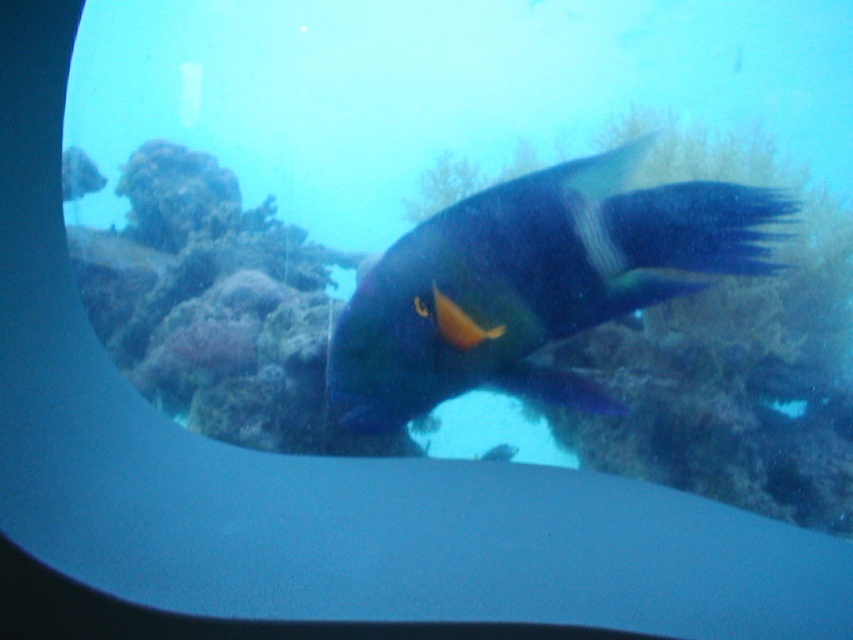
Is purple coral at center to the left of shiny blue fish at center from the viewer's perspective?

Correct, you'll find purple coral at center to the left of shiny blue fish at center.

Which is above, purple coral at center or shiny blue fish at center?

shiny blue fish at center

The width and height of the screenshot is (853, 640). Identify the location of purple coral at center. (734, 387).

Where is `purple coral at center`? purple coral at center is located at coordinates (734, 387).